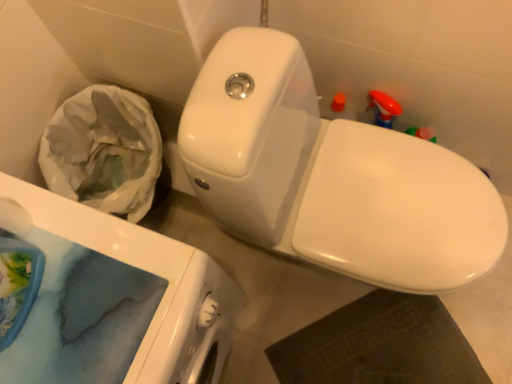
Question: Is white glossy toilet at center at the back of white matte toilet paper at lower left?

Choices:
 (A) no
 (B) yes

Answer: (A)

Question: Can you confirm if white matte toilet paper at lower left is wider than white glossy toilet at center?

Choices:
 (A) no
 (B) yes

Answer: (A)

Question: Is white matte toilet paper at lower left to the right of white glossy toilet at center from the viewer's perspective?

Choices:
 (A) no
 (B) yes

Answer: (A)

Question: Could you tell me if white matte toilet paper at lower left is facing white glossy toilet at center?

Choices:
 (A) no
 (B) yes

Answer: (A)

Question: Considering the relative positions of white matte toilet paper at lower left and white glossy toilet at center in the image provided, is white matte toilet paper at lower left in front of white glossy toilet at center?

Choices:
 (A) yes
 (B) no

Answer: (B)

Question: From a real-world perspective, is white matte toilet paper at lower left over white glossy toilet at center?

Choices:
 (A) yes
 (B) no

Answer: (A)

Question: Does white glossy porcelain at upper right lie behind white glossy toilet at center?

Choices:
 (A) no
 (B) yes

Answer: (B)

Question: Is white glossy porcelain at upper right smaller than white glossy toilet at center?

Choices:
 (A) no
 (B) yes

Answer: (A)

Question: From the image's perspective, is white glossy porcelain at upper right under white glossy toilet at center?

Choices:
 (A) yes
 (B) no

Answer: (A)

Question: From a real-world perspective, is white glossy porcelain at upper right positioned under white glossy toilet at center based on gravity?

Choices:
 (A) no
 (B) yes

Answer: (B)

Question: Is white glossy porcelain at upper right positioned with its back to white glossy toilet at center?

Choices:
 (A) yes
 (B) no

Answer: (B)

Question: Is white glossy porcelain at upper right wider than white glossy toilet at center?

Choices:
 (A) yes
 (B) no

Answer: (B)

Question: Is white matte toilet paper at lower left positioned with its back to white glossy porcelain at upper right?

Choices:
 (A) yes
 (B) no

Answer: (B)